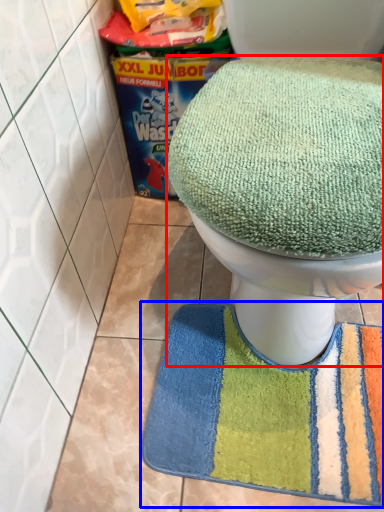
Question: Which of the following is the farthest to the observer, toilet (highlighted by a red box) or bath mat (highlighted by a blue box)?

Choices:
 (A) toilet
 (B) bath mat

Answer: (B)